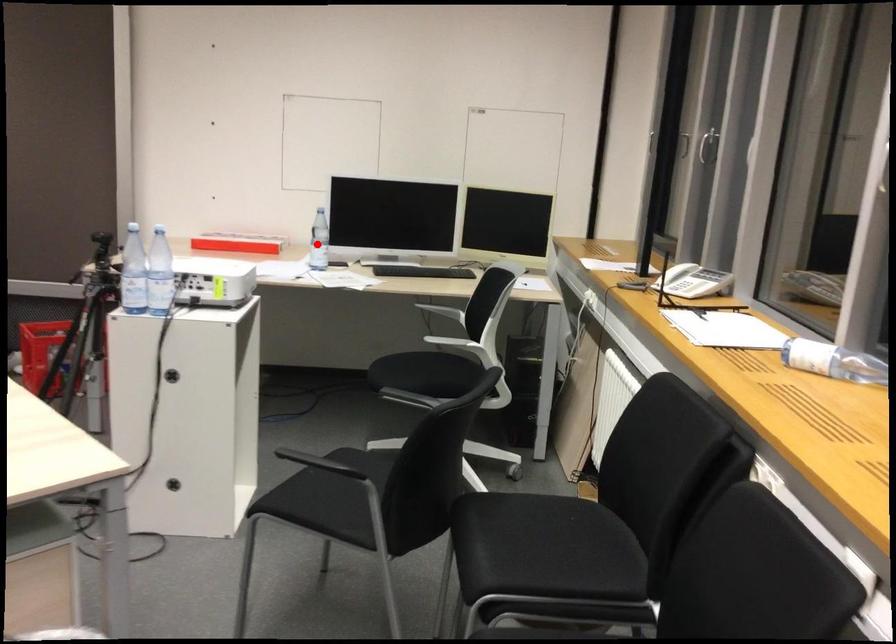
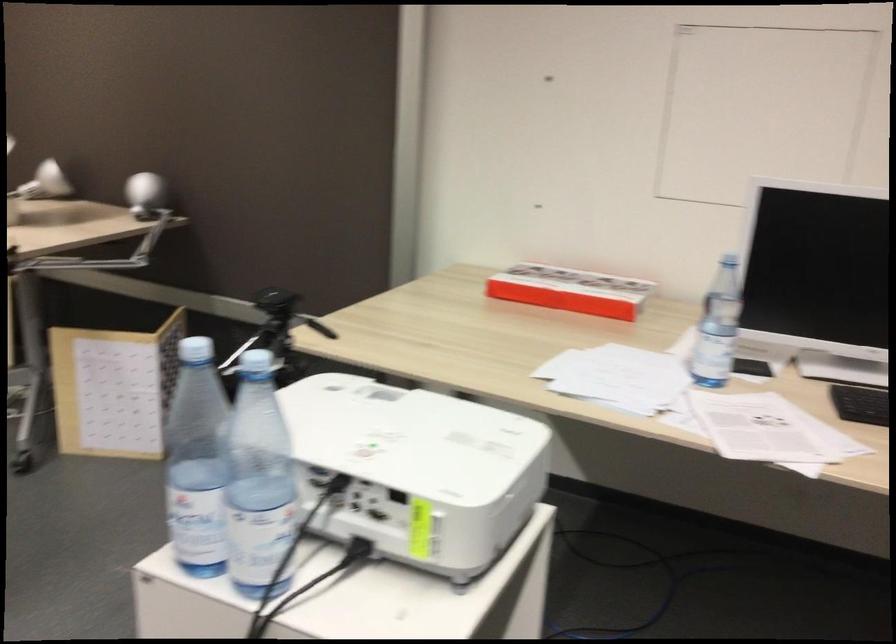
Where in the second image is the point corresponding to the highlighted location from the first image?

(718, 327)